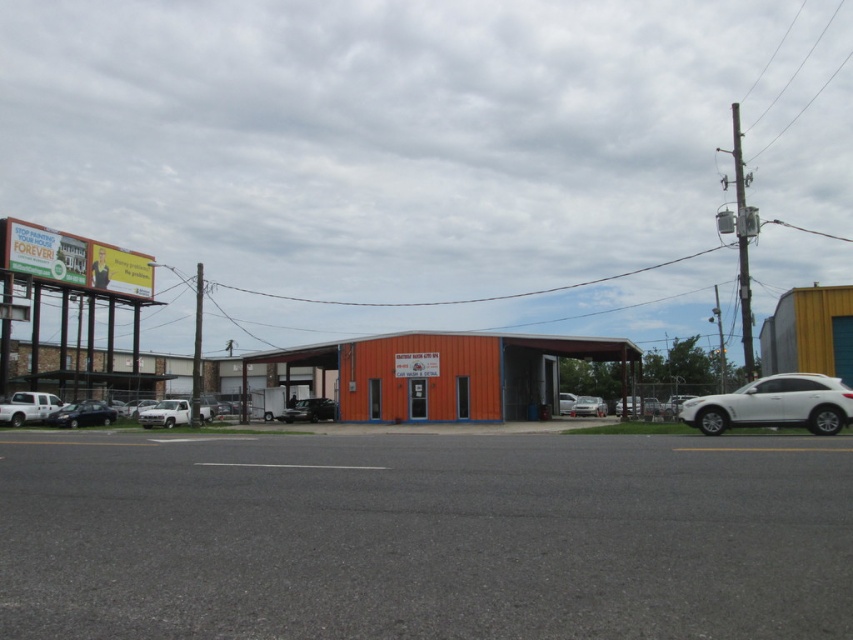
Question: Which object appears closest to the camera in this image?

Choices:
 (A) white matte truck at center-left
 (B) shiny black sedan at lower left
 (C) white matte car at center
 (D) shiny black van at center

Answer: (A)

Question: Is shiny black van at center above white matte suv at center?

Choices:
 (A) no
 (B) yes

Answer: (B)

Question: Does shiny black van at center appear under white matte car at center?

Choices:
 (A) yes
 (B) no

Answer: (B)

Question: Which point appears closest to the camera in this image?

Choices:
 (A) (601, 410)
 (B) (648, 413)
 (C) (561, 404)
 (D) (1, 417)

Answer: (B)

Question: Does white matte truck at center-left appear over shiny black van at center?

Choices:
 (A) yes
 (B) no

Answer: (B)

Question: Which of the following is the closest to the observer?

Choices:
 (A) (589, 408)
 (B) (782, 419)
 (C) (289, 400)
 (D) (97, 412)

Answer: (B)